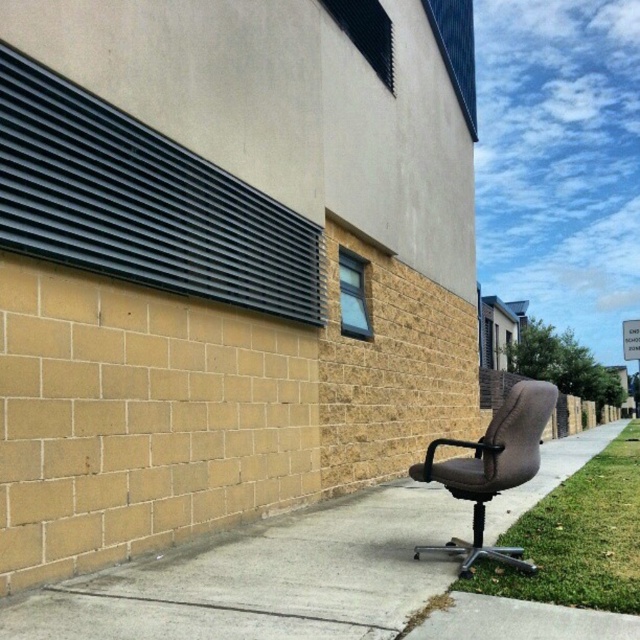
Question: Does brown leather chair at right appear on the left side of brown leather office chair at lower right?

Choices:
 (A) no
 (B) yes

Answer: (A)

Question: Estimate the real-world distances between objects in this image. Which object is farther from the brown leather office chair at lower right?

Choices:
 (A) brown leather chair at right
 (B) green grass at lower right

Answer: (B)

Question: Is brown leather chair at right to the right of green grass at lower right from the viewer's perspective?

Choices:
 (A) no
 (B) yes

Answer: (A)

Question: Based on their relative distances, which object is farther from the brown leather chair at right?

Choices:
 (A) green grass at lower right
 (B) brown leather office chair at lower right

Answer: (B)

Question: Considering the real-world distances, which object is closest to the green grass at lower right?

Choices:
 (A) brown leather chair at right
 (B) brown leather office chair at lower right

Answer: (A)

Question: Does brown leather chair at right appear over green grass at lower right?

Choices:
 (A) yes
 (B) no

Answer: (A)